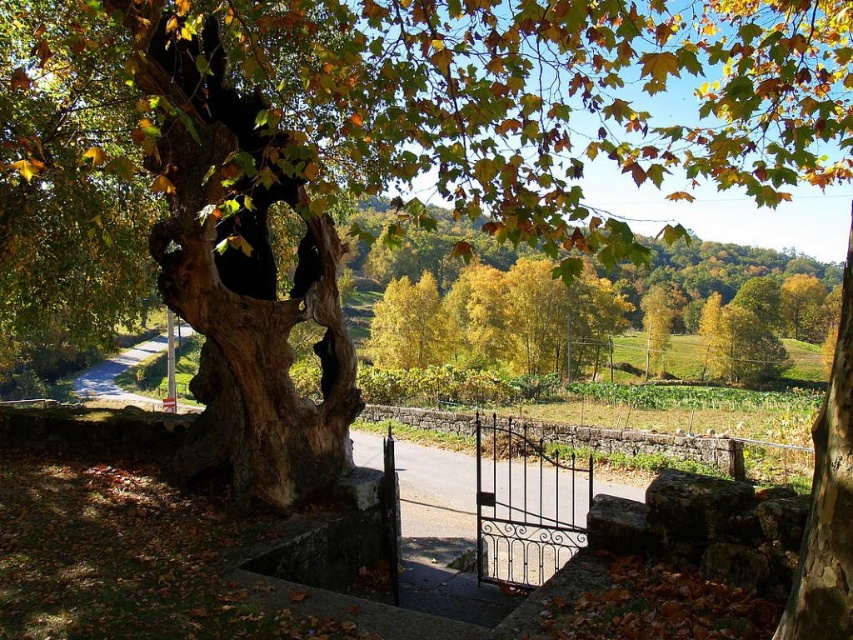
You are a painter standing at the start of the stone pathway and want to paint both the black wrought iron gate at center and the brown rough bark at center. Which object should you focus on first if you want to paint the larger one closer to you?

The black wrought iron gate at center is bigger than the brown rough bark at center, so you should focus on painting the black wrought iron gate at center first since it is larger and closer to you.

You are standing at the entrance of a rural autumn landscape and see a point marked at coordinates (747, 289). What color are the leaves located at that point?

The point at (747, 289) marks yellow green leaves at center.

You are standing at the entrance of the rural landscape scene and want to walk towards the two points marked in the image. Which point, point (688, 442) or point (682, 253), will you reach first?

Point (688, 442) is in front of point (682, 253), so you will reach point (688, 442) first.